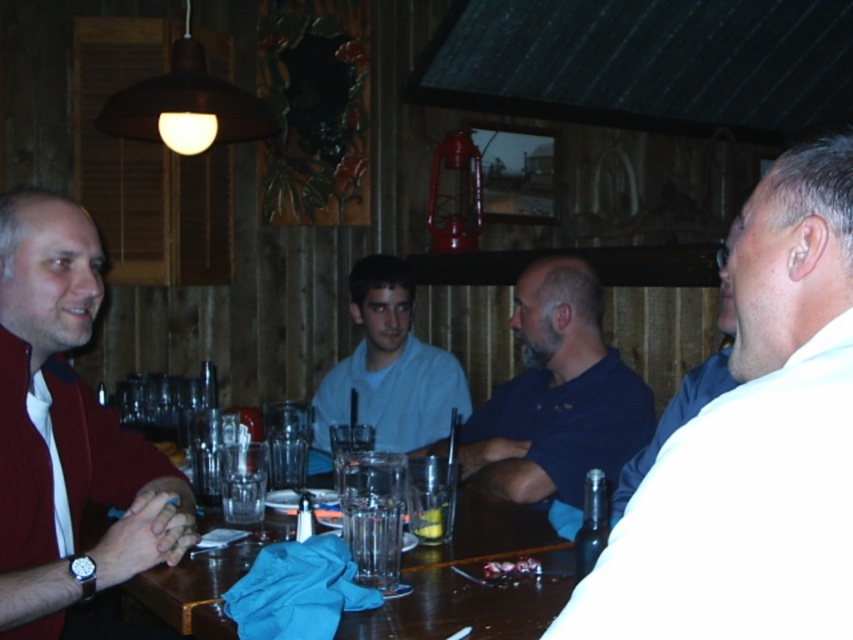
Question: Is white matte shirt at right positioned in front of black glass bottle at lower right?

Choices:
 (A) yes
 (B) no

Answer: (A)

Question: Considering the real-world distances, which object is closest to the white matte shirt at right?

Choices:
 (A) light blue cotton shirt at center
 (B) dark blue shirt at center
 (C) wooden table at center
 (D) white shirt at right

Answer: (D)

Question: Can you confirm if wooden table at center is wider than white shirt at right?

Choices:
 (A) no
 (B) yes

Answer: (B)

Question: Can you confirm if dark blue shirt at center is thinner than light blue cotton shirt at center?

Choices:
 (A) yes
 (B) no

Answer: (B)

Question: Which point is farther to the camera?

Choices:
 (A) wooden table at center
 (B) transparent glass at table center
 (C) white shirt at right

Answer: (B)

Question: Which object appears farthest from the camera in this image?

Choices:
 (A) matte red jacket at left
 (B) light blue cotton shirt at center
 (C) black glass bottle at lower right

Answer: (B)